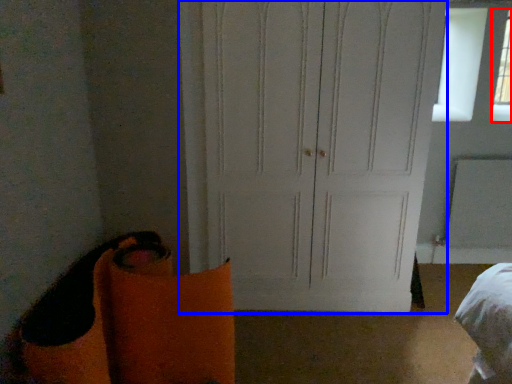
Question: Which object is further to the camera taking this photo, window (highlighted by a red box) or door (highlighted by a blue box)?

Choices:
 (A) window
 (B) door

Answer: (A)